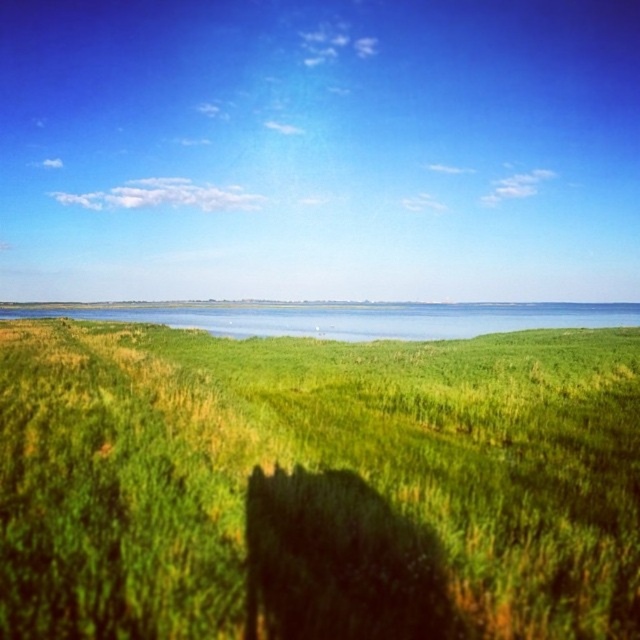
Is point (276, 419) closer to viewer compared to point (445, 316)?

That is True.

Between green grassy field at center and blue water at center, which one has more height?

blue water at center

Who is more distant from viewer, (220,566) or (576,321)?

Point (576,321)

The height and width of the screenshot is (640, 640). What are the coordinates of `green grassy field at center` in the screenshot? It's located at (316, 484).